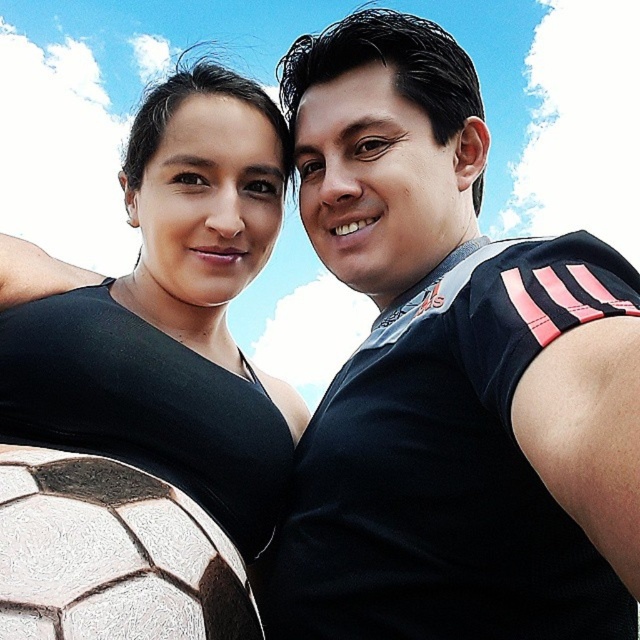
Can you confirm if black matte jersey at center is bigger than matte black dress at center?

Yes, black matte jersey at center is bigger than matte black dress at center.

Image resolution: width=640 pixels, height=640 pixels. Find the location of `black matte jersey at center`. black matte jersey at center is located at coordinates (451, 374).

Where is `black matte jersey at center`? Image resolution: width=640 pixels, height=640 pixels. black matte jersey at center is located at coordinates (451, 374).